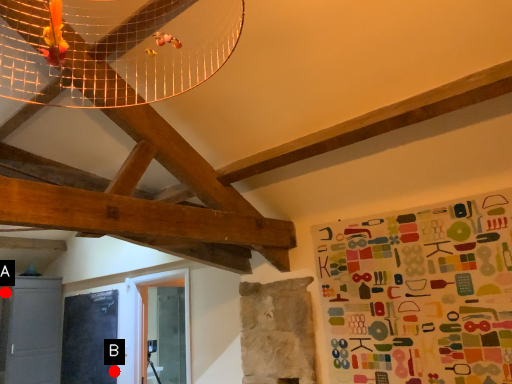
Question: Two points are circled on the image, labeled by A and B beside each circle. Which point is farther from the camera taking this photo?

Choices:
 (A) A is further
 (B) B is further

Answer: (A)